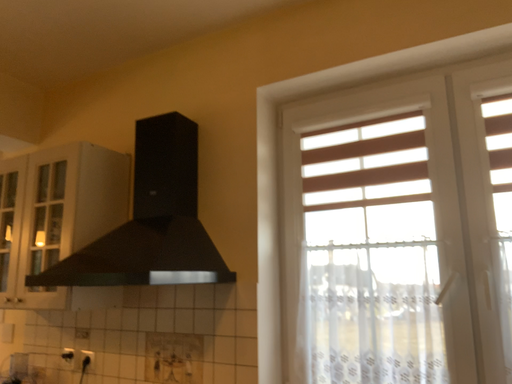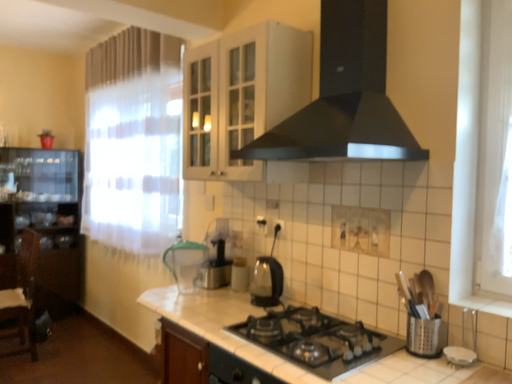
Question: How did the camera likely rotate when shooting the video?

Choices:
 (A) rotated downward
 (B) rotated upward

Answer: (A)